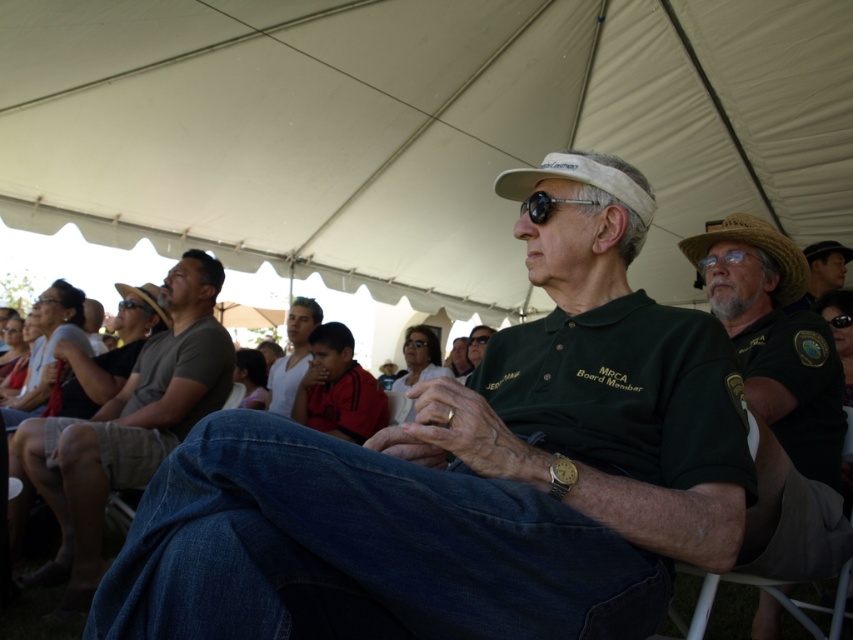
You are a photographer at the event and want to take a photo of the white cotton tank top at center without the white fabric canopy at upper center casting a shadow on it. What should you do?

Move the white cotton tank top at center to a position where it is not directly under the white fabric canopy at upper center, as the canopy is above it and could cast a shadow.